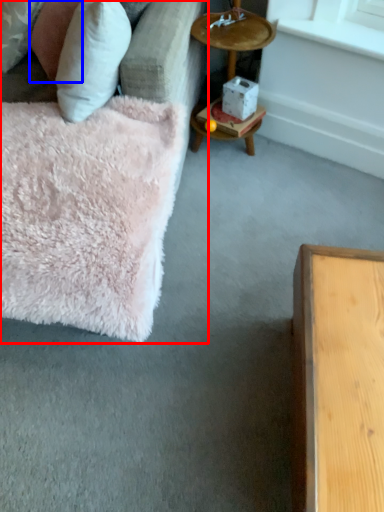
Question: Among these objects, which one is nearest to the camera, studio couch (highlighted by a red box) or pillow (highlighted by a blue box)?

Choices:
 (A) studio couch
 (B) pillow

Answer: (A)